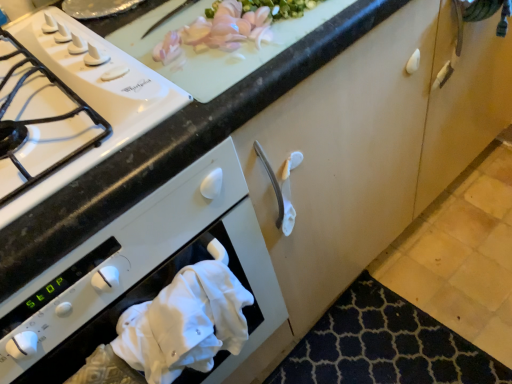
Question: Looking at the image, does white cotton hand towel at lower left seem bigger or smaller compared to dark blue textured mat at lower right?

Choices:
 (A) big
 (B) small

Answer: (B)

Question: Is white cotton hand towel at lower left taller or shorter than dark blue textured mat at lower right?

Choices:
 (A) short
 (B) tall

Answer: (B)

Question: Which object is the closest to the dark blue textured mat at lower right?

Choices:
 (A) white cloth at lower left
 (B) white cotton hand towel at lower left
 (C) white glossy gas stove at left
 (D) white fabric at lower left

Answer: (D)

Question: Based on their relative distances, which object is nearer to the white fabric at lower left?

Choices:
 (A) white cotton hand towel at lower left
 (B) dark blue textured mat at lower right
 (C) white cloth at lower left
 (D) white glossy gas stove at left

Answer: (A)